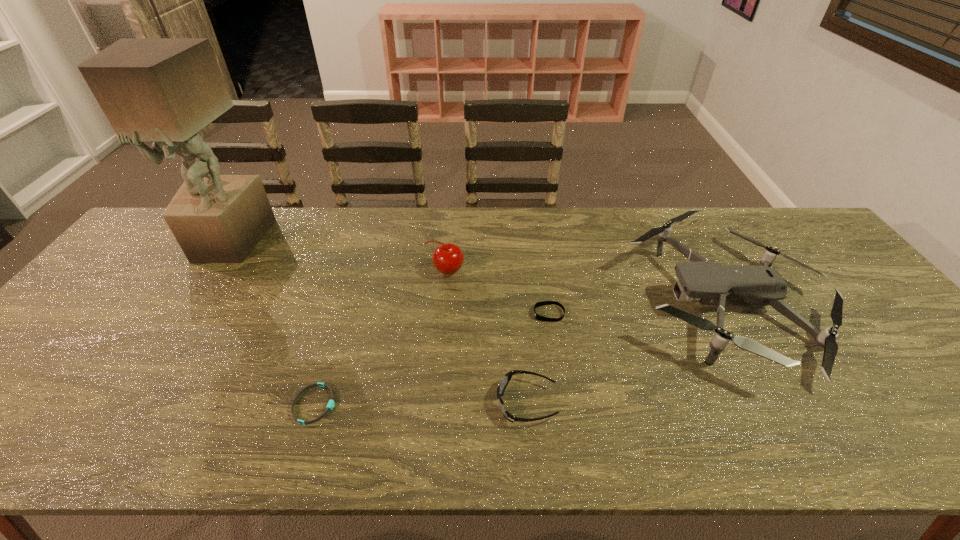
Image resolution: width=960 pixels, height=540 pixels. I want to click on vacant region at the right edge, so click(x=918, y=364).

Locate an element on the screen. Image resolution: width=960 pixels, height=540 pixels. free location at the far right corner of the desktop is located at coordinates (777, 220).

Where is `vacant space that's between the rightmost object and the second object from left to right`? The image size is (960, 540). vacant space that's between the rightmost object and the second object from left to right is located at coordinates (519, 354).

This screenshot has width=960, height=540. I want to click on vacant point located between the cherry and the leftmost object, so click(338, 256).

This screenshot has height=540, width=960. Identify the location of free space between the cherry and the taller wristband. (497, 292).

Find the location of a particular element. The image size is (960, 540). free space between the shorter wristband and the taller wristband is located at coordinates (431, 359).

At what (x,y) coordinates should I click in order to perform the action: click on empty space between the rightmost object and the sunglasses. Please return your answer as a coordinate pair (x, y). This screenshot has height=540, width=960. Looking at the image, I should click on (626, 353).

The image size is (960, 540). Identify the location of vacant area between the sculpture and the farther wristband. (389, 278).

This screenshot has height=540, width=960. Find the location of `free area in between the leftmost object and the rightmost object`. free area in between the leftmost object and the rightmost object is located at coordinates (477, 273).

Locate an element on the screen. unoccupied position between the right wristband and the left wristband is located at coordinates (431, 359).